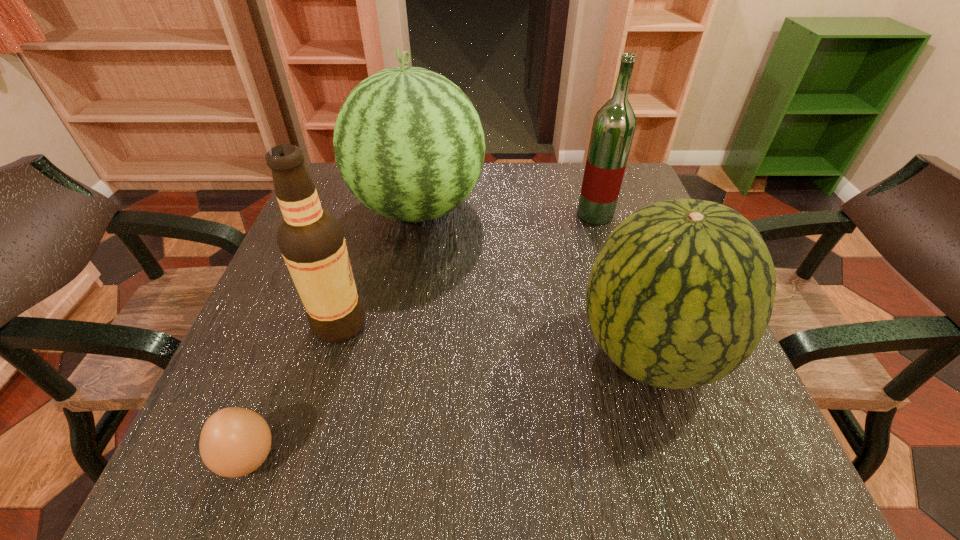
Where is `watermelon positioned at the right edge`? The image size is (960, 540). watermelon positioned at the right edge is located at coordinates (680, 294).

Where is `object at the far left corner`? Image resolution: width=960 pixels, height=540 pixels. object at the far left corner is located at coordinates (409, 144).

You are a GUI agent. You are given a task and a screenshot of the screen. Output one action in this format:
    pyautogui.click(x=<x>, y=<y>)
    Task: Click on the object at the near left corner
    The image size is (960, 540).
    Given the screenshot: What is the action you would take?
    pyautogui.click(x=234, y=442)

Locate an element on the screen. This screenshot has height=540, width=960. object that is positioned at the far right corner is located at coordinates (613, 128).

The image size is (960, 540). In order to click on free space at the far edge in this screenshot , I will do `click(469, 196)`.

In the image, there is a desktop. Where is `vacant region at the near edge`? This screenshot has height=540, width=960. vacant region at the near edge is located at coordinates (459, 453).

Locate an element on the screen. vacant space at the right edge of the desktop is located at coordinates (756, 421).

Image resolution: width=960 pixels, height=540 pixels. In the image, there is a desktop. In order to click on vacant region at the far right corner in this screenshot , I will do `click(633, 192)`.

In the image, there is a desktop. Where is `vacant space at the near right corner`? The width and height of the screenshot is (960, 540). vacant space at the near right corner is located at coordinates (755, 436).

The height and width of the screenshot is (540, 960). Find the location of `unoccupied position between the shortest object and the alcohol`. unoccupied position between the shortest object and the alcohol is located at coordinates (295, 391).